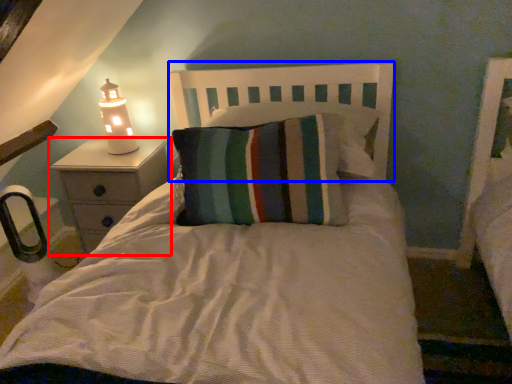
Question: Among these objects, which one is farthest to the camera, nightstand (highlighted by a red box) or headboard (highlighted by a blue box)?

Choices:
 (A) nightstand
 (B) headboard

Answer: (A)